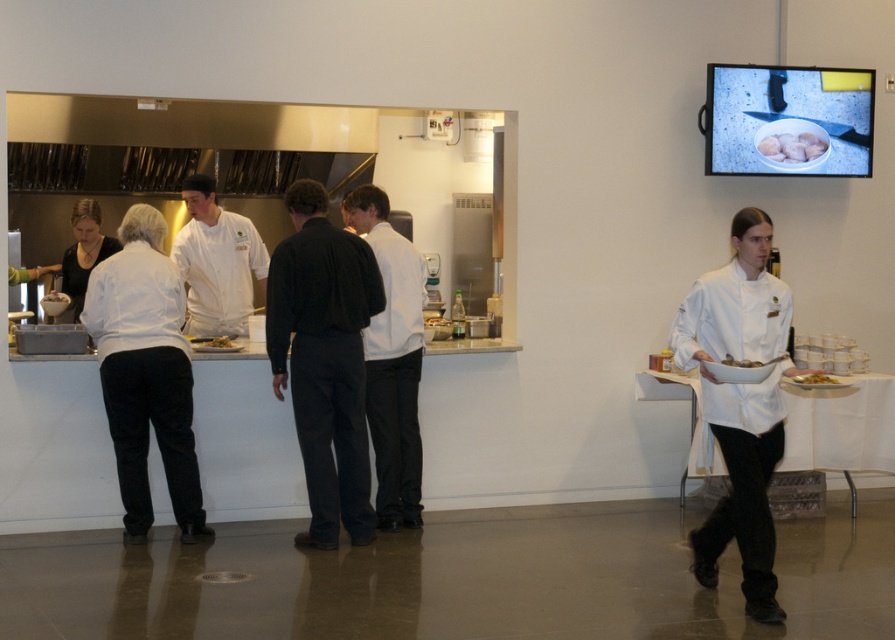
Question: Does black cotton shirt at center have a smaller size compared to white glossy chicken at upper right?

Choices:
 (A) yes
 (B) no

Answer: (B)

Question: Which object appears farthest from the camera in this image?

Choices:
 (A) white glossy bowl at right
 (B) black cotton shirt at center
 (C) white matte uniform at right
 (D) white matte shirt at center

Answer: (D)

Question: Where is white matte shirt at center located in relation to white glossy chicken at upper right in the image?

Choices:
 (A) right
 (B) left

Answer: (B)

Question: Based on their relative distances, which object is farther from the matte white plate at center?

Choices:
 (A) white matte shirt at center
 (B) white glossy bowl at right
 (C) green leafy salad at right

Answer: (C)

Question: Is white matte shirt at center to the left of white glossy bowl at right from the viewer's perspective?

Choices:
 (A) yes
 (B) no

Answer: (A)

Question: Among these objects, which one is nearest to the camera?

Choices:
 (A) white matte uniform at right
 (B) green leafy salad at right

Answer: (A)